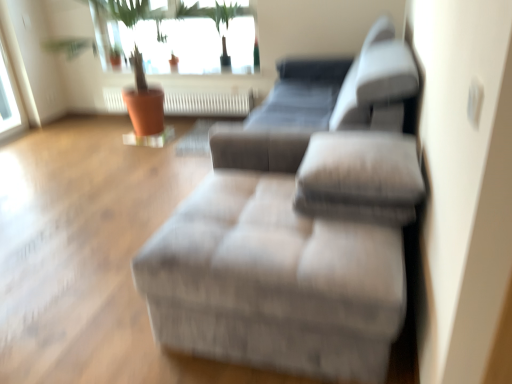
Question: Would you consider silver metallic radiator at center to be distant from textured gray ottoman at center?

Choices:
 (A) yes
 (B) no

Answer: (A)

Question: Is the surface of silver metallic radiator at center in direct contact with textured gray ottoman at center?

Choices:
 (A) no
 (B) yes

Answer: (A)

Question: From the image's perspective, would you say silver metallic radiator at center is positioned over textured gray ottoman at center?

Choices:
 (A) no
 (B) yes

Answer: (B)

Question: Is silver metallic radiator at center oriented away from textured gray ottoman at center?

Choices:
 (A) yes
 (B) no

Answer: (B)

Question: Is textured gray ottoman at center completely or partially inside silver metallic radiator at center?

Choices:
 (A) yes
 (B) no

Answer: (B)

Question: Does silver metallic radiator at center have a greater height compared to textured gray ottoman at center?

Choices:
 (A) yes
 (B) no

Answer: (B)

Question: Is white glass window at upper left, which is the 2th window from right to left, taller than textured gray ottoman at center?

Choices:
 (A) yes
 (B) no

Answer: (A)

Question: Can you confirm if white glass window at upper left, which ranks as the 1th window in left-to-right order, is positioned to the left of textured gray ottoman at center?

Choices:
 (A) no
 (B) yes

Answer: (B)

Question: From the image's perspective, is white glass window at upper left, which ranks as the 1th window in left-to-right order, on top of textured gray ottoman at center?

Choices:
 (A) yes
 (B) no

Answer: (A)

Question: Is white glass window at upper left, which is the 2th window from right to left, looking in the opposite direction of textured gray ottoman at center?

Choices:
 (A) yes
 (B) no

Answer: (B)

Question: Can you confirm if white glass window at upper left, which is the 2th window from right to left, is shorter than textured gray ottoman at center?

Choices:
 (A) no
 (B) yes

Answer: (A)

Question: Is textured gray ottoman at center completely or partially inside white glass window at upper left, which is the 2th window from right to left?

Choices:
 (A) no
 (B) yes

Answer: (A)

Question: Could you tell me if silver metallic radiator at center is facing white glass window at upper left, which ranks as the 1th window in left-to-right order?

Choices:
 (A) yes
 (B) no

Answer: (B)